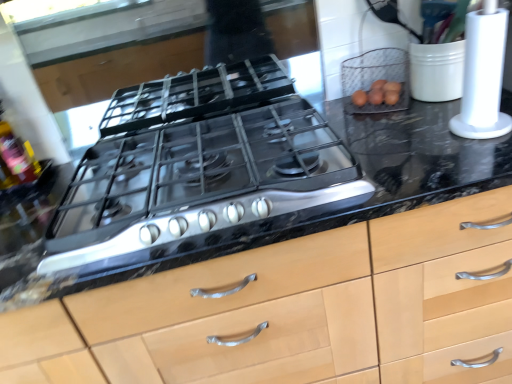
At what (x,y) coordinates should I click in order to perform the action: click on free space that is to the left of white plastic paper towel holder at right. Please return your answer as a coordinate pair (x, y). Looking at the image, I should click on (408, 144).